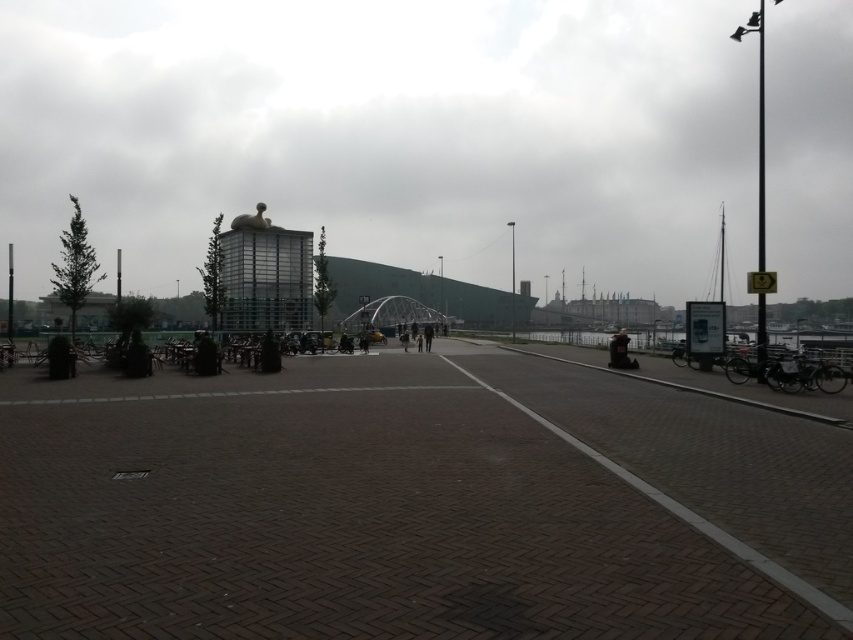
Is dark gray stone statue at lower right positioned behind dark gray jacket at center?

That is False.

Is point (624, 364) in front of point (427, 342)?

Yes, point (624, 364) is in front of point (427, 342).

At what (x,y) coordinates should I click in order to perform the action: click on dark gray stone statue at lower right. Please return your answer as a coordinate pair (x, y). Image resolution: width=853 pixels, height=640 pixels. Looking at the image, I should click on (619, 352).

Locate an element on the screen. The width and height of the screenshot is (853, 640). dark gray stone statue at lower right is located at coordinates (619, 352).

Does transparent glass building at center have a greater height compared to dark gray jacket at center?

Yes.

Who is more distant from viewer, [543,65] or [428,349]?

Positioned behind is point [543,65].

Is point (595, 93) more distant than point (428, 340)?

That is True.

You are a GUI agent. You are given a task and a screenshot of the screen. Output one action in this format:
    pyautogui.click(x=<x>, y=<y>)
    Task: Click on the transparent glass building at center
    Image resolution: width=853 pixels, height=640 pixels.
    Given the screenshot: What is the action you would take?
    pyautogui.click(x=386, y=134)

Is brown brick plaza at center positioned at the back of dark gray stone statue at lower right?

That is False.

Is point (611, 515) farther from viewer compared to point (624, 340)?

No.

The height and width of the screenshot is (640, 853). What do you see at coordinates (415, 504) in the screenshot? I see `brown brick plaza at center` at bounding box center [415, 504].

The width and height of the screenshot is (853, 640). I want to click on brown brick plaza at center, so click(415, 504).